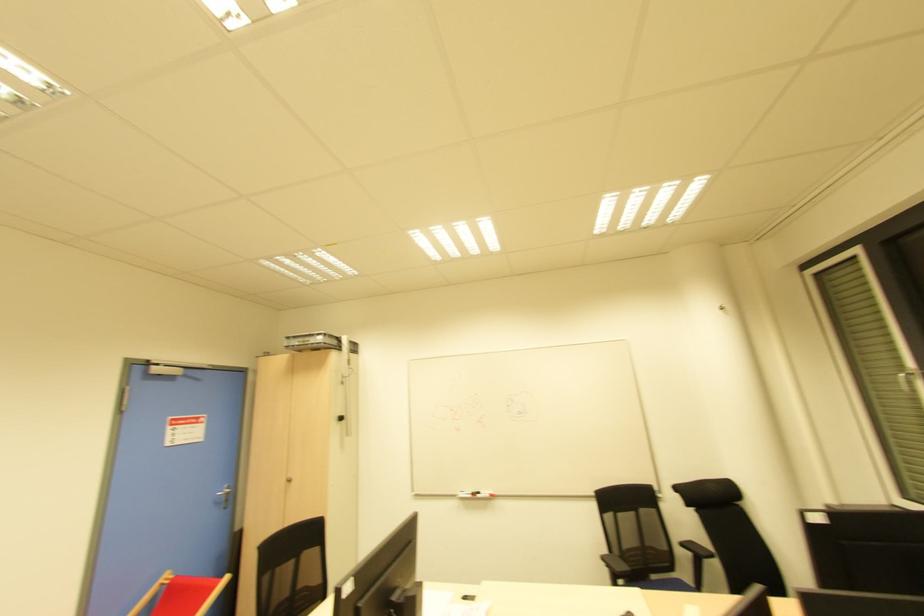
What do you see at coordinates (224, 496) in the screenshot? The width and height of the screenshot is (924, 616). I see `the silver door handle` at bounding box center [224, 496].